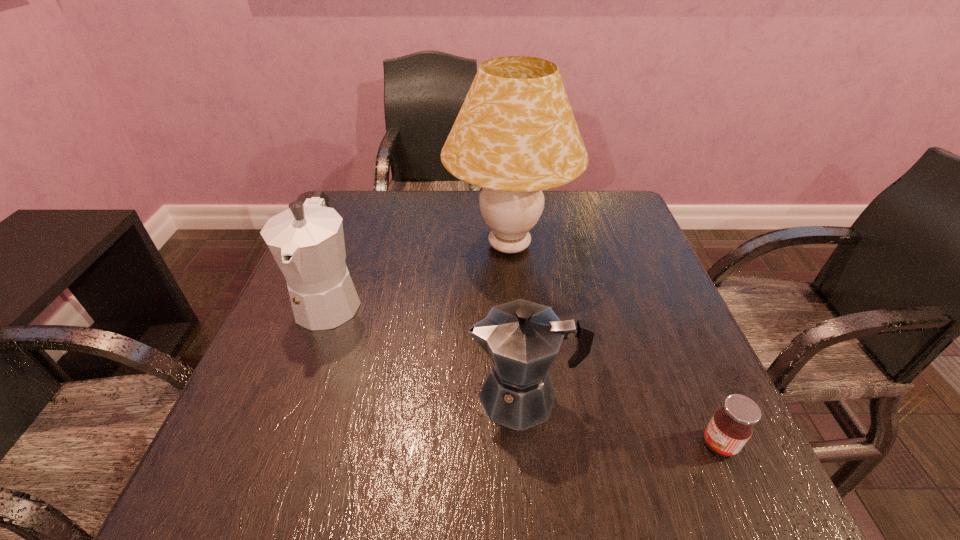
Where is `vacant area between the second shortest object and the third shortest object`? vacant area between the second shortest object and the third shortest object is located at coordinates (426, 348).

You are a GUI agent. You are given a task and a screenshot of the screen. Output one action in this format:
    pyautogui.click(x=<x>, y=<y>)
    Task: Click on the vacant area between the shorter coffeepot and the second tallest object
    The height and width of the screenshot is (540, 960).
    Given the screenshot: What is the action you would take?
    pyautogui.click(x=426, y=348)

Identify the location of vacant region between the shortest object and the lampshade. The width and height of the screenshot is (960, 540). (614, 345).

This screenshot has width=960, height=540. I want to click on free space between the left coffeepot and the third tallest object, so click(x=426, y=348).

Where is `object that is the closest to the farther coffeepot`? This screenshot has width=960, height=540. object that is the closest to the farther coffeepot is located at coordinates (515, 135).

Identify the location of object that is the second closest to the lampshade. The image size is (960, 540). (522, 338).